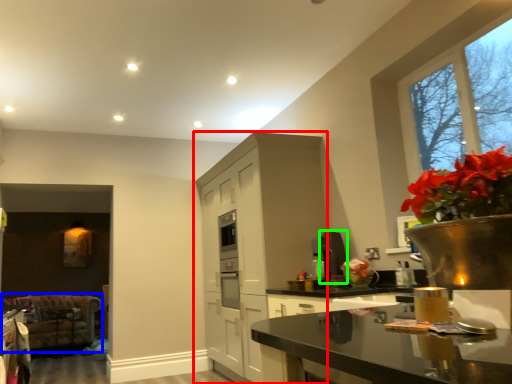
Question: Based on their relative distances, which object is nearer to cabinetry (highlighted by a red box)? Choose from armchair (highlighted by a blue box) and appliance (highlighted by a green box).

Choices:
 (A) armchair
 (B) appliance

Answer: (B)